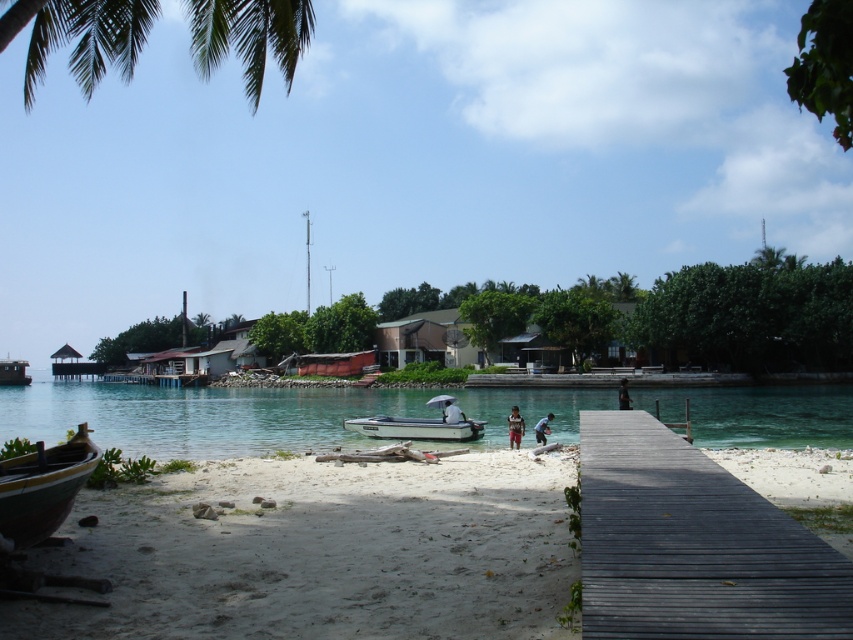
Question: Can you confirm if blue fabric shirt at center is smaller than dark gray fabric shirt at center?

Choices:
 (A) no
 (B) yes

Answer: (B)

Question: Estimate the real-world distances between objects in this image. Which object is farther from the white sandy beach at lower right?

Choices:
 (A) dark gray wood dock at lower right
 (B) clear blue water at center
 (C) brown cotton shirt at center
 (D) green leafy palm tree at upper left

Answer: (D)

Question: Where is wooden canoe at lower left located in relation to brown cotton shirt at center in the image?

Choices:
 (A) above
 (B) below

Answer: (A)

Question: Which point is closer to the camera taking this photo?

Choices:
 (A) (399, 349)
 (B) (444, 410)

Answer: (B)

Question: Which object appears closest to the camera in this image?

Choices:
 (A) wooden canoe at lower left
 (B) white plastic boat at center
 (C) brown wooden hut at center
 (D) clear blue water at center

Answer: (A)

Question: Can you confirm if brown cotton shirt at center is wider than dark gray fabric shirt at center?

Choices:
 (A) no
 (B) yes

Answer: (A)